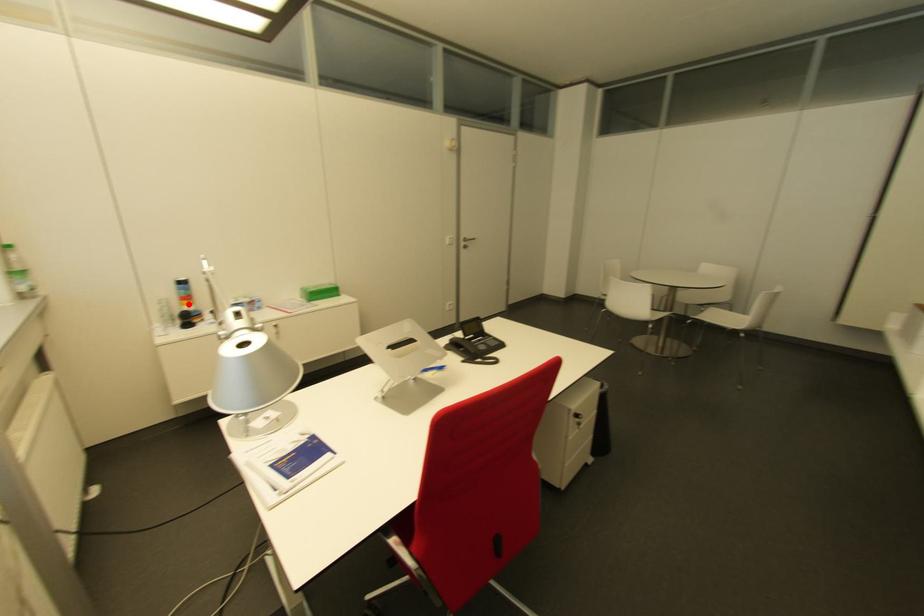
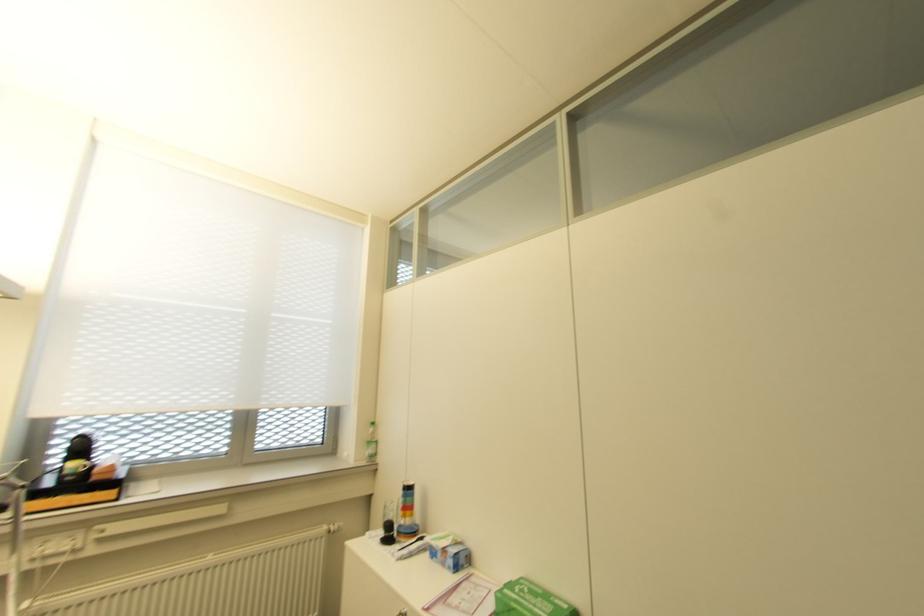
In the second image, find the point that corresponds to the highlighted location in the first image.

(402, 517)